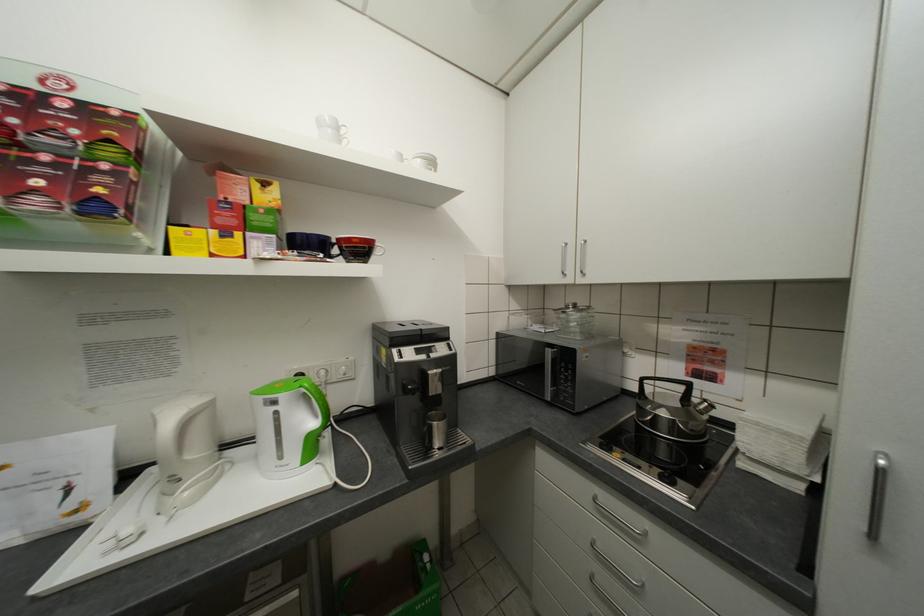
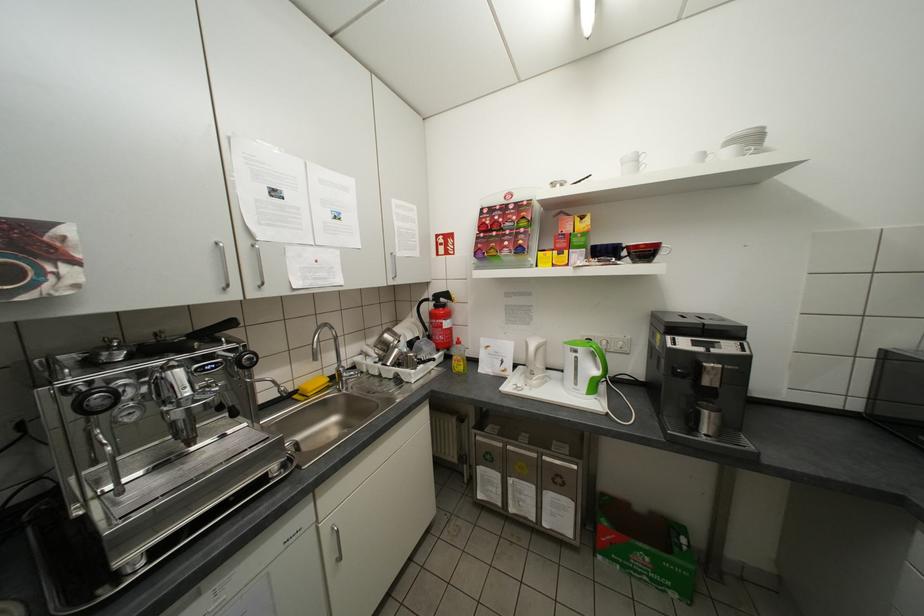
Locate, in the second image, the point that corresponds to (x=287, y=438) in the first image.

(585, 373)